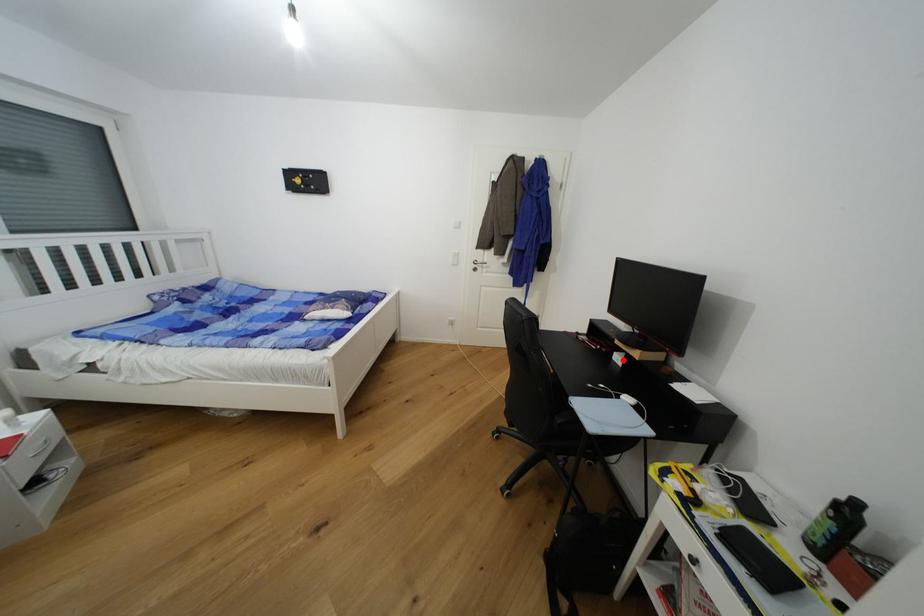
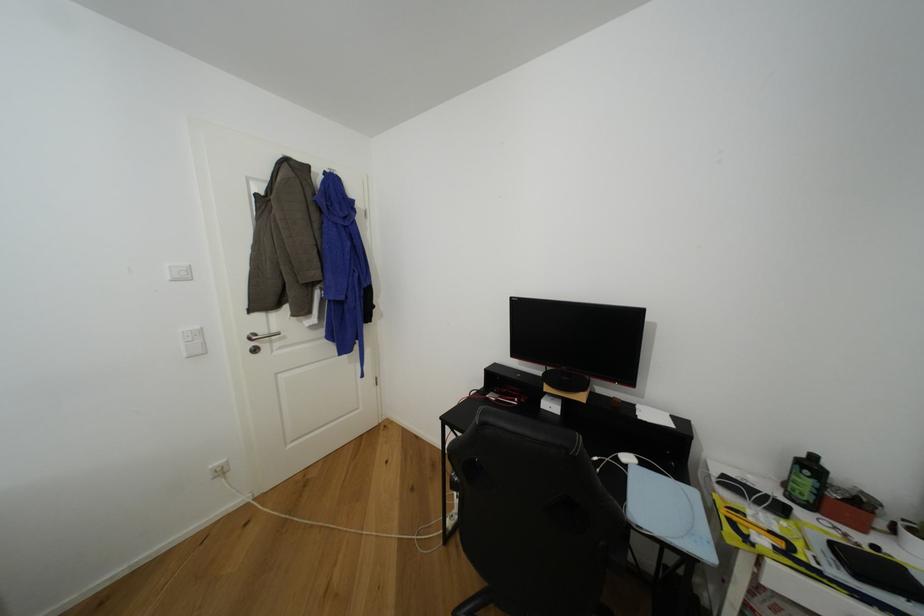
In the second image, find the point that corresponds to the highlighted location in the first image.

(555, 408)